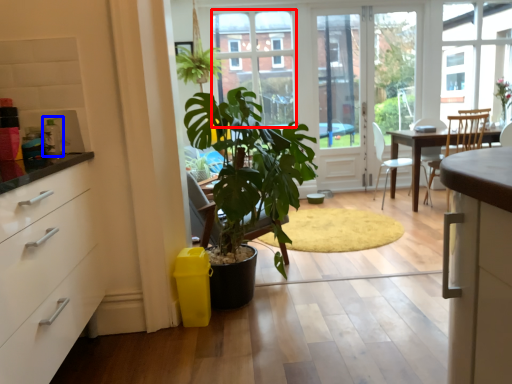
Question: Which object appears farthest to the camera in this image, bay window (highlighted by a red box) or appliance (highlighted by a blue box)?

Choices:
 (A) bay window
 (B) appliance

Answer: (A)